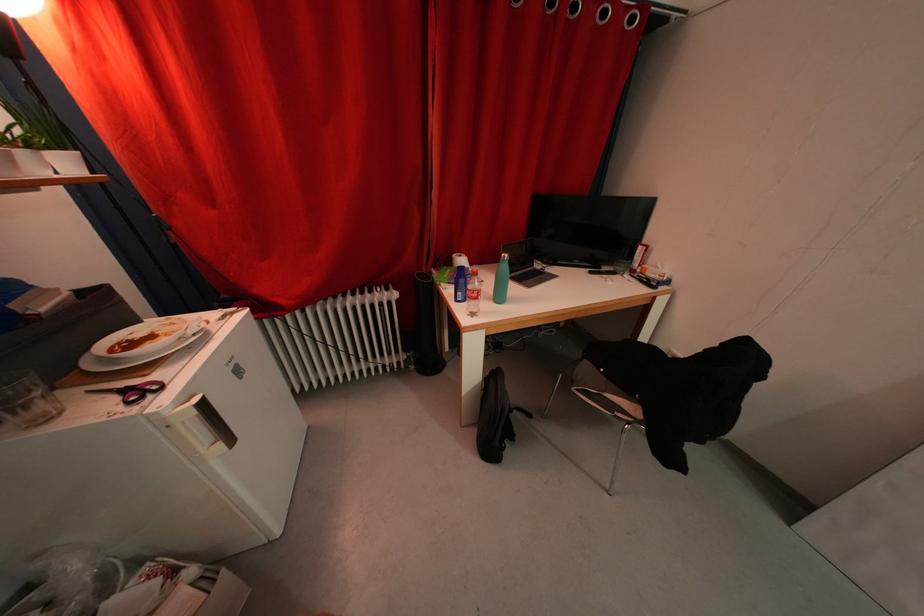
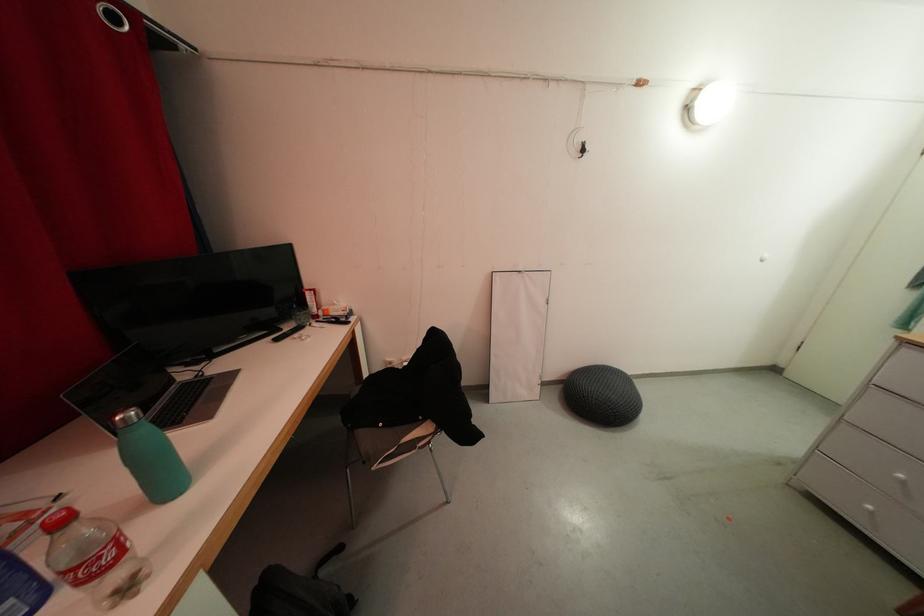
Question: I am providing you with two images of the same scene from different viewpoints. Which of the following objects are not visible in image2?

Choices:
 (A) green water bottle
 (B) black backpack
 (C) black remote control
 (D) none of these

Answer: (D)